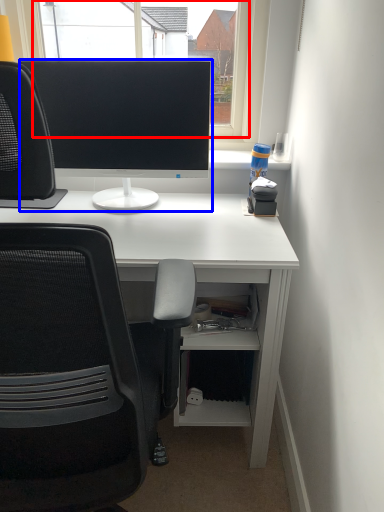
Question: Which of the following is the closest to the observer, window screen (highlighted by a red box) or computer monitor (highlighted by a blue box)?

Choices:
 (A) window screen
 (B) computer monitor

Answer: (B)